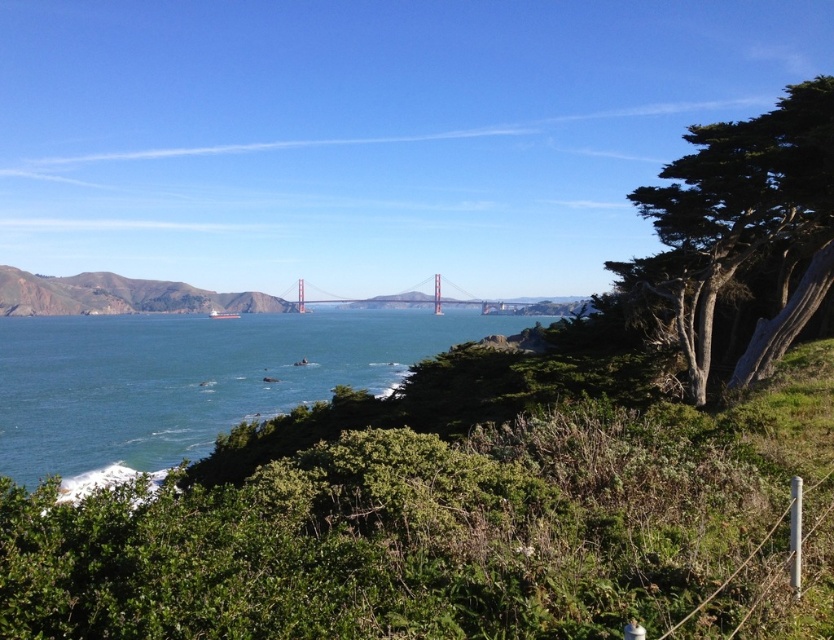
Question: Can you confirm if blue water at center is positioned above painted steel bridge at center?

Choices:
 (A) no
 (B) yes

Answer: (A)

Question: Which of the following is the closest to the observer?

Choices:
 (A) (159, 289)
 (B) (194, 317)

Answer: (B)

Question: Which point is farther to the camera?

Choices:
 (A) painted steel bridge at center
 (B) blue water at center
 (C) brown rocky hill at left

Answer: (A)

Question: Among these points, which one is farthest from the camera?

Choices:
 (A) (79, 420)
 (B) (498, 305)

Answer: (B)

Question: Does brown rocky hill at left come in front of painted steel bridge at center?

Choices:
 (A) yes
 (B) no

Answer: (A)

Question: Observing the image, what is the correct spatial positioning of blue water at center in reference to brown rocky hill at left?

Choices:
 (A) below
 (B) above

Answer: (A)